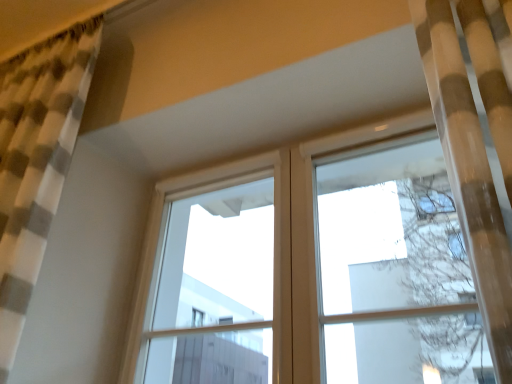
Question: In the image, is white plastic window frame at upper center positioned in front of or behind checkered fabric curtain at left?

Choices:
 (A) front
 (B) behind

Answer: (B)

Question: Looking at their shapes, would you say white plastic window frame at upper center is wider or thinner than checkered fabric curtain at left?

Choices:
 (A) thin
 (B) wide

Answer: (A)

Question: From a real-world perspective, is white plastic window frame at upper center physically located above or below checkered fabric curtain at left?

Choices:
 (A) above
 (B) below

Answer: (B)

Question: Is checkered fabric curtain at left situated inside white plastic window frame at upper center or outside?

Choices:
 (A) outside
 (B) inside

Answer: (A)

Question: Is checkered fabric curtain at left bigger or smaller than white plastic window frame at upper center?

Choices:
 (A) big
 (B) small

Answer: (A)

Question: Relative to white plastic window frame at upper center, is checkered fabric curtain at left in front or behind?

Choices:
 (A) front
 (B) behind

Answer: (A)

Question: From their relative heights in the image, would you say checkered fabric curtain at left is taller or shorter than white plastic window frame at upper center?

Choices:
 (A) tall
 (B) short

Answer: (A)